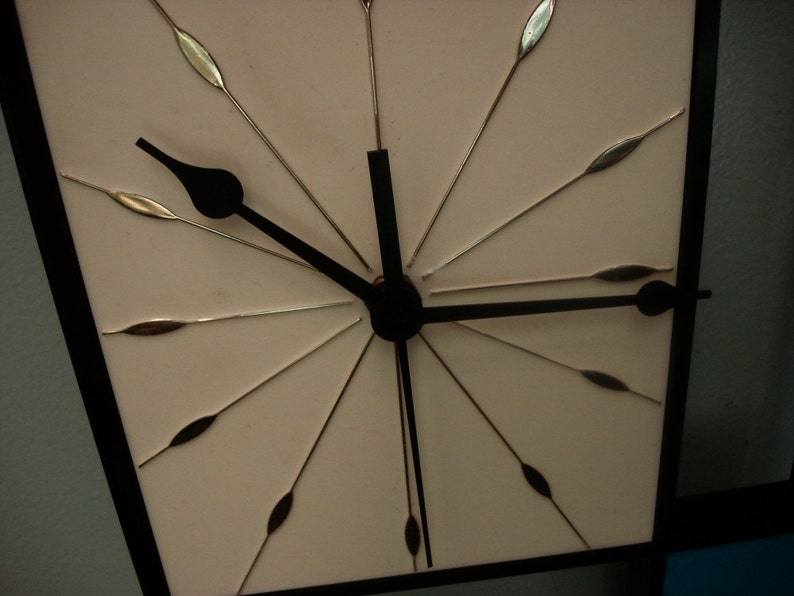
Identify the location of wall behind the clock. This screenshot has height=596, width=794. (56, 477), (744, 321).